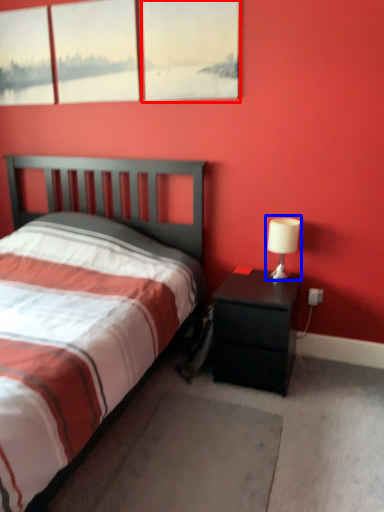
Question: Which object is further to the camera taking this photo, window (highlighted by a red box) or table lamp (highlighted by a blue box)?

Choices:
 (A) window
 (B) table lamp

Answer: (B)